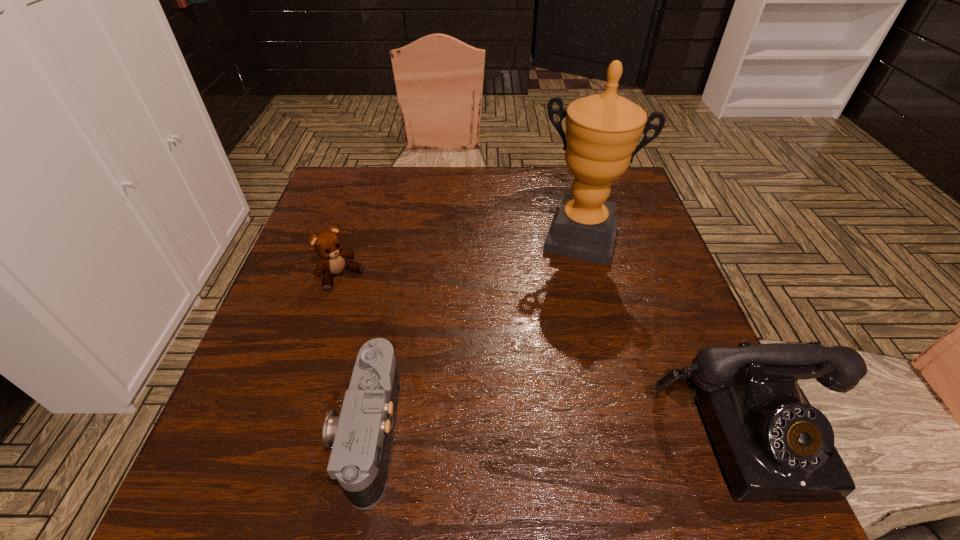
You are a GUI agent. You are given a task and a screenshot of the screen. Output one action in this format:
    pyautogui.click(x=<x>, y=<y>)
    Task: Click on the third object from right to left
    
    Given the screenshot: What is the action you would take?
    (361, 438)

This screenshot has height=540, width=960. What are the coordinates of `the third shortest object` in the screenshot? It's located at (774, 446).

Where is `teddy bear`? teddy bear is located at coordinates click(327, 245).

Find the location of `award`. award is located at coordinates (602, 131).

Where is `vacant point located 0.150m on the lens of the camera`? Image resolution: width=960 pixels, height=540 pixels. vacant point located 0.150m on the lens of the camera is located at coordinates (252, 432).

Where is `vacant space located on the front-facing side of the leftmost object`? The height and width of the screenshot is (540, 960). vacant space located on the front-facing side of the leftmost object is located at coordinates (443, 374).

At what (x,y) coordinates should I click in order to perform the action: click on free space located 0.320m on the front-facing side of the leftmost object. Please return your answer as a coordinate pair (x, y). The image size is (960, 540). Looking at the image, I should click on (443, 374).

Identify the location of vacant point located 0.250m on the front-facing side of the leftmost object. This screenshot has width=960, height=540. click(x=420, y=352).

At what (x,y) coordinates should I click in order to perform the action: click on free space located at the front of the award with handles. Please return your answer as a coordinate pair (x, y). Looking at the image, I should click on (543, 366).

Locate an element on the screen. This screenshot has width=960, height=540. free space located at the front of the award with handles is located at coordinates (559, 312).